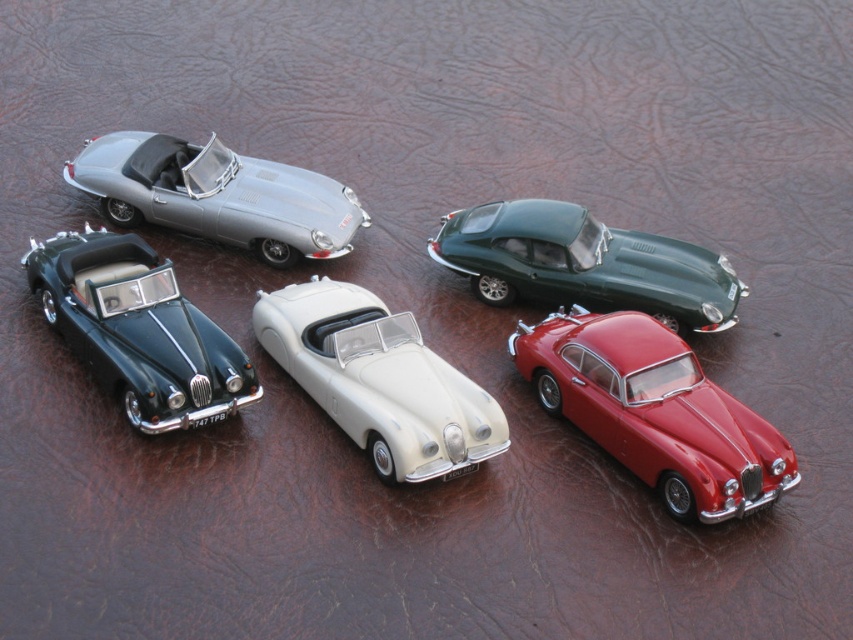
Between glossy red car at lower right and satin silver car at upper left, which one is positioned higher?

satin silver car at upper left is higher up.

Who is shorter, glossy red car at lower right or satin silver car at upper left?

Standing shorter between the two is satin silver car at upper left.

The image size is (853, 640). Describe the element at coordinates (654, 412) in the screenshot. I see `glossy red car at lower right` at that location.

Locate an element on the screen. This screenshot has width=853, height=640. glossy red car at lower right is located at coordinates click(x=654, y=412).

In the scene shown: Measure the distance between point (347, 323) and camera.

Point (347, 323) and camera are 10.90 meters apart.

The width and height of the screenshot is (853, 640). What do you see at coordinates (379, 380) in the screenshot?
I see `white matte convertible at center` at bounding box center [379, 380].

The width and height of the screenshot is (853, 640). I want to click on white matte convertible at center, so click(379, 380).

Describe the element at coordinates (379, 380) in the screenshot. I see `white matte convertible at center` at that location.

Between point (253, 323) and point (254, 394), which one is positioned behind?

Point (253, 323)

At what (x,y) coordinates should I click in order to perform the action: click on white matte convertible at center. Please return your answer as a coordinate pair (x, y). Looking at the image, I should click on click(x=379, y=380).